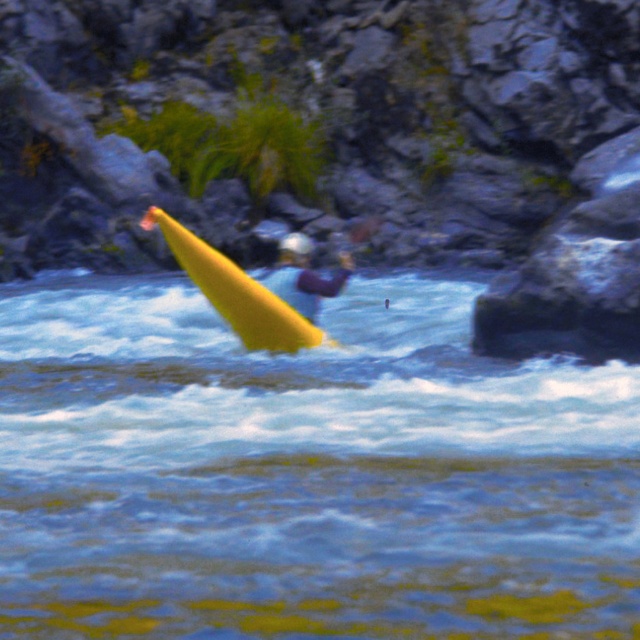
Which is behind, point (198, 436) or point (208, 280)?

The point (208, 280) is behind.

Who is more forward, (394, 403) or (280, 349)?

Point (394, 403) is more forward.

Does point (323, 572) come farther from viewer compared to point (266, 305)?

That is False.

Locate an element on the screen. yellow rubber boat at upper left is located at coordinates (305, 472).

Is shiny yellow canoe at center wider than smooth purple helmet at center?

Indeed, shiny yellow canoe at center has a greater width compared to smooth purple helmet at center.

This screenshot has height=640, width=640. What do you see at coordinates (236, 291) in the screenshot? I see `shiny yellow canoe at center` at bounding box center [236, 291].

Locate an element on the screen. shiny yellow canoe at center is located at coordinates (236, 291).

Who is positioned more to the right, yellow rubber boat at upper left or smooth purple helmet at center?

Answer: smooth purple helmet at center

Measure the distance between point (490,429) and camera.

Point (490,429) is 10.82 meters from camera.

Which is in front, point (442, 282) or point (275, 273)?

Positioned in front is point (275, 273).

Where is `yellow rubber boat at upper left`? yellow rubber boat at upper left is located at coordinates (305, 472).